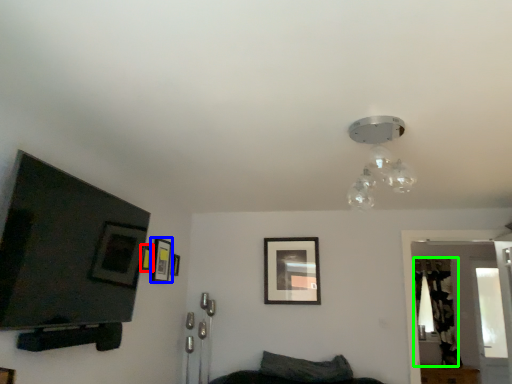
Question: Considering the real-world distances, which object is closest to picture frame (highlighted by a red box)? picture frame (highlighted by a blue box) or curtain (highlighted by a green box).

Choices:
 (A) picture frame
 (B) curtain

Answer: (A)